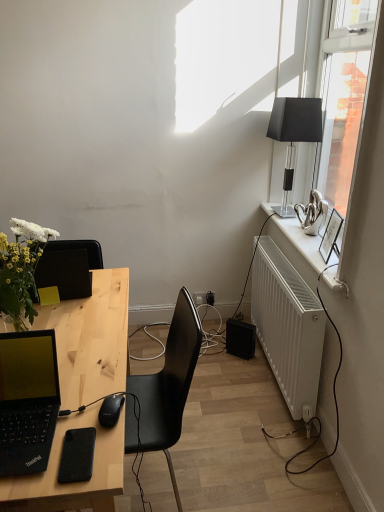
You are a GUI agent. You are given a task and a screenshot of the screen. Output one action in this format:
    pyautogui.click(x=<x>, y=<y>)
    Task: Click on the vacant area situated to the left side of white matte radiator at right
    The height and width of the screenshot is (512, 384).
    Given the screenshot: What is the action you would take?
    pyautogui.click(x=233, y=376)